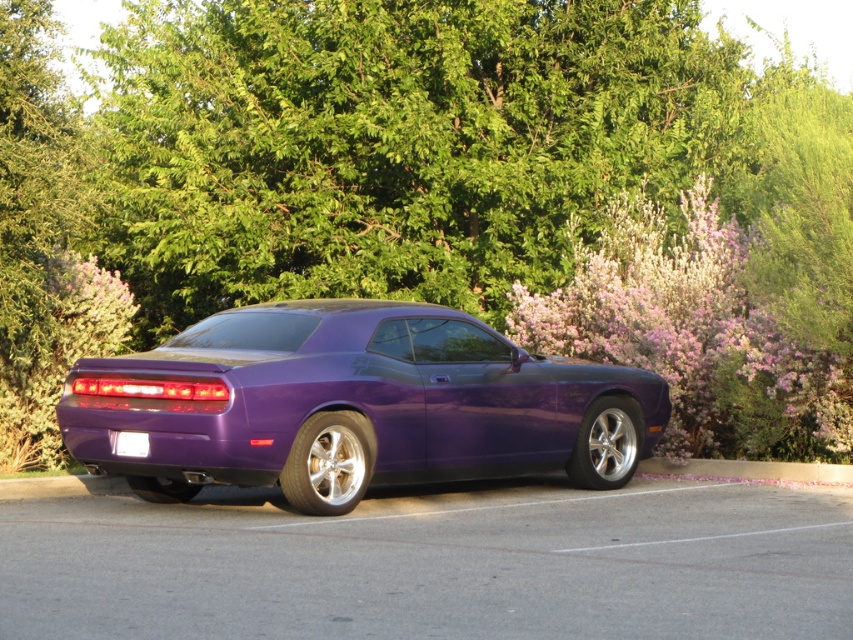
Question: Which of the following is the farthest from the observer?

Choices:
 (A) (189, 134)
 (B) (720, 499)
 (C) (587, 333)
 (D) (173, 467)

Answer: (A)

Question: Can you confirm if smooth asphalt at lower center is wider than pink fluffy bush at right?

Choices:
 (A) yes
 (B) no

Answer: (B)

Question: Does glossy purple car at center have a smaller size compared to pink fluffy bush at right?

Choices:
 (A) no
 (B) yes

Answer: (B)

Question: Can you confirm if smooth asphalt at lower center is positioned to the right of pink fluffy bush at right?

Choices:
 (A) no
 (B) yes

Answer: (B)

Question: Based on their relative distances, which object is nearer to the green leafy tree at upper center?

Choices:
 (A) pink fluffy bush at right
 (B) glossy purple car at center
 (C) smooth asphalt at lower center

Answer: (B)

Question: Which is nearer to the green leafy tree at upper center?

Choices:
 (A) pink fluffy bush at right
 (B) smooth asphalt at lower center

Answer: (A)